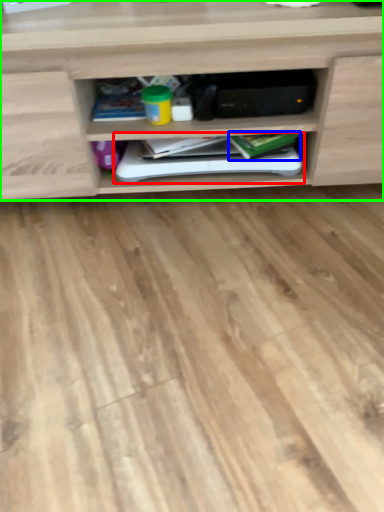
Question: Estimate the real-world distances between objects in this image. Which object is farther from book (highlighted by a red box), book (highlighted by a blue box) or shelf (highlighted by a green box)?

Choices:
 (A) book
 (B) shelf

Answer: (B)